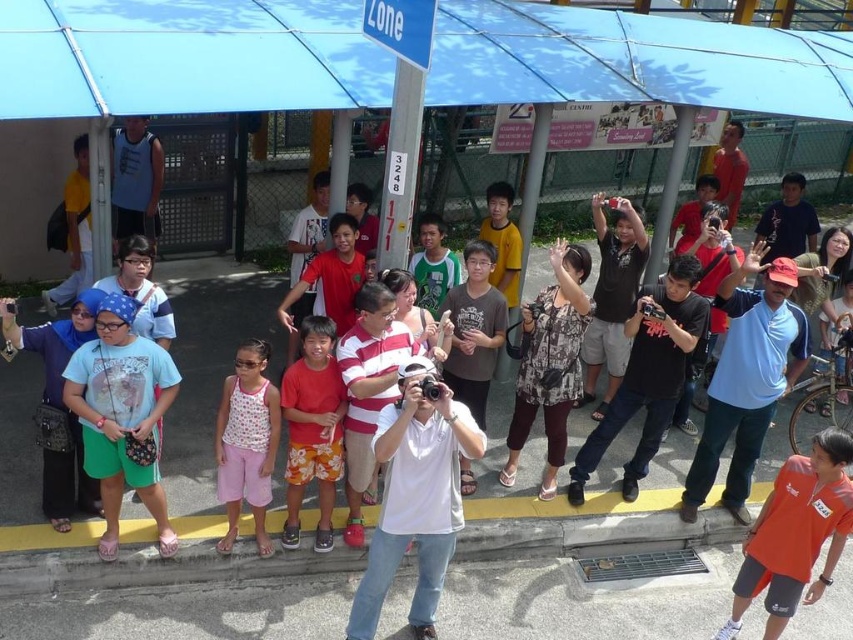
You are a photographer trying to take a photo of the orange jersey at center without the white cotton camera at center blocking the view. Can you do it?

The white cotton camera at center is much taller than the orange jersey at center, so it might block the view. You might need to move the white cotton camera at center or adjust your angle to avoid it.

You are a photographer carrying a small backpack. You want to place both the white cotton camera at center and the orange jersey at center into your backpack. Which item should you place first to ensure both fit properly?

The white cotton camera at center is larger than the orange jersey at center, so you should place the white cotton camera at center first to make sure there is enough space for both items.